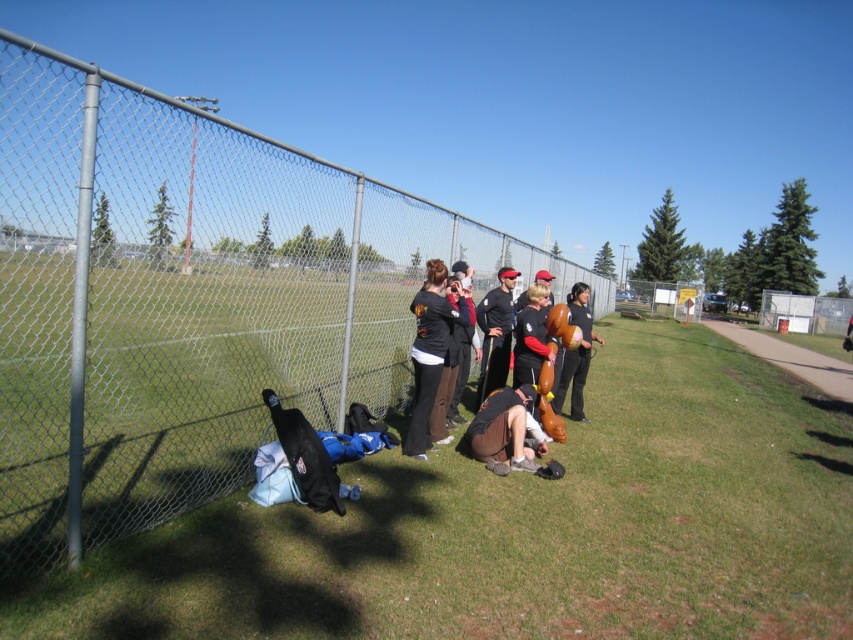
Question: Can you confirm if metal chain-link fence at center is wider than matte black balloon at right?

Choices:
 (A) no
 (B) yes

Answer: (B)

Question: Which object is farther from the camera taking this photo?

Choices:
 (A) black matte baseball cap at center
 (B) black matte balloon at center
 (C) green grass at center
 (D) matte black balloon at right

Answer: (A)

Question: Can you confirm if green grass at center is thinner than black matte balloon at center?

Choices:
 (A) no
 (B) yes

Answer: (A)

Question: Is the position of metal chain-link fence at center more distant than that of matte black balloon at right?

Choices:
 (A) yes
 (B) no

Answer: (B)

Question: Which point appears farthest from the camera in this image?

Choices:
 (A) (850, 408)
 (B) (467, 317)

Answer: (A)

Question: Estimate the real-world distances between objects in this image. Which object is farther from the brown cotton pants at lower center?

Choices:
 (A) metal chain-link fence at center
 (B) black matte shirt at center
 (C) green grass at center
 (D) black matte baseball cap at center

Answer: (A)